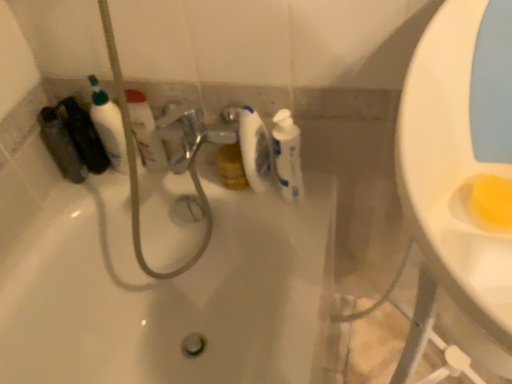
Where is `vacant space to the left of white glossy bottle at upper left, which ranks as the second cleaning product in right-to-left order`? vacant space to the left of white glossy bottle at upper left, which ranks as the second cleaning product in right-to-left order is located at coordinates (90, 182).